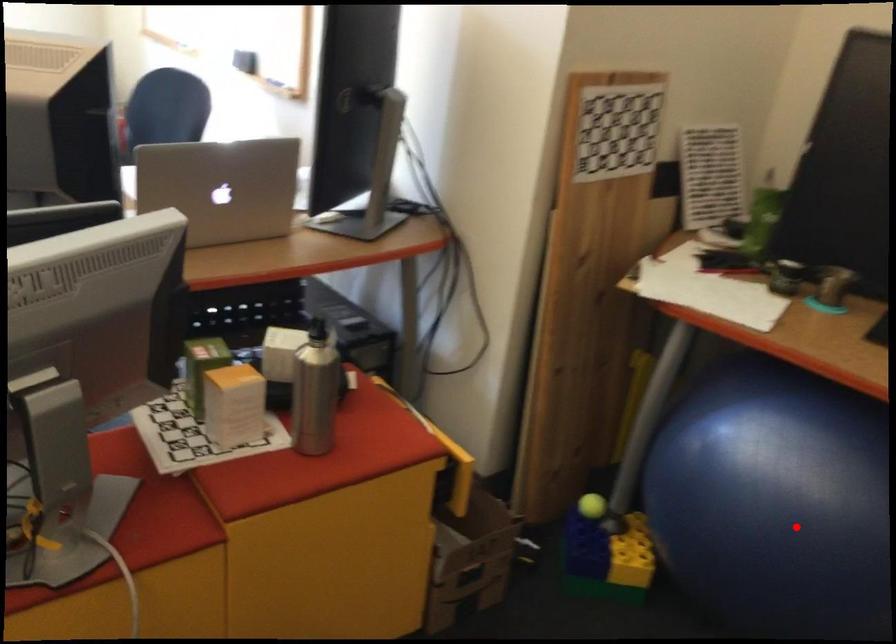
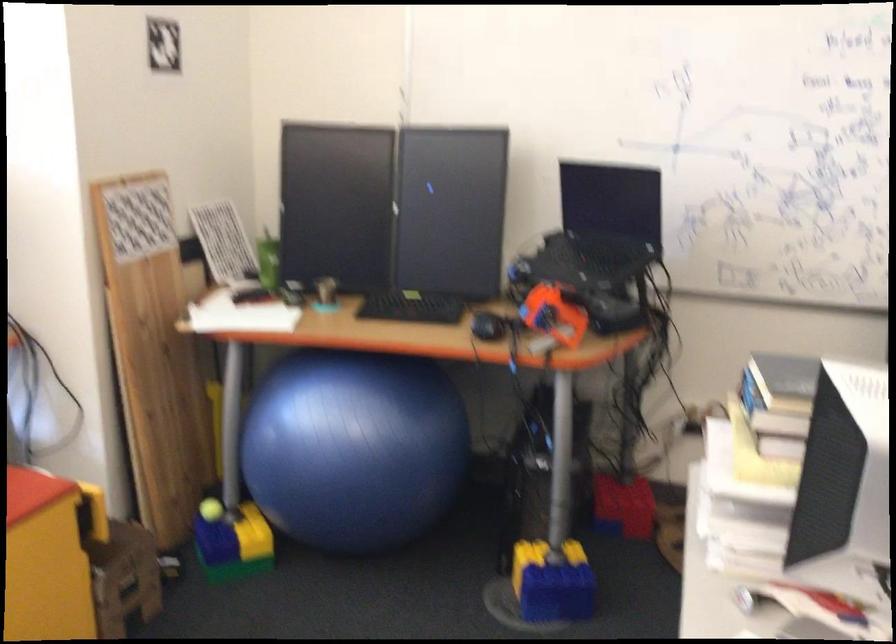
The point at the highlighted location is marked in the first image. Where is the corresponding point in the second image?

(355, 448)